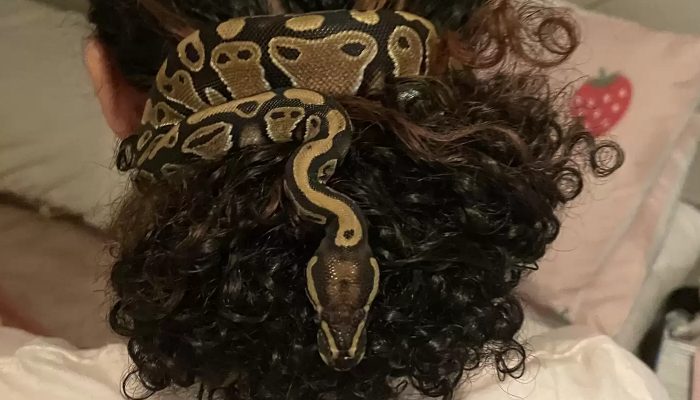
Identify the location of blanket. tap(64, 288).